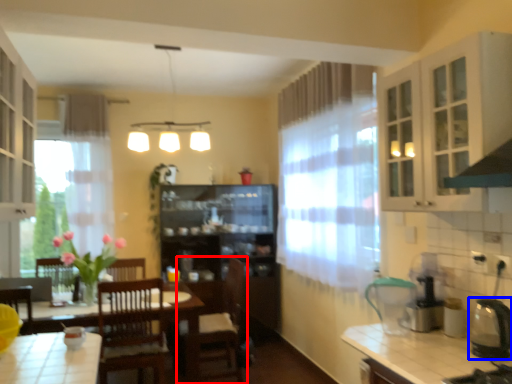
Question: Which of the following is the closest to the observer, chair (highlighted by a red box) or appliance (highlighted by a blue box)?

Choices:
 (A) chair
 (B) appliance

Answer: (B)